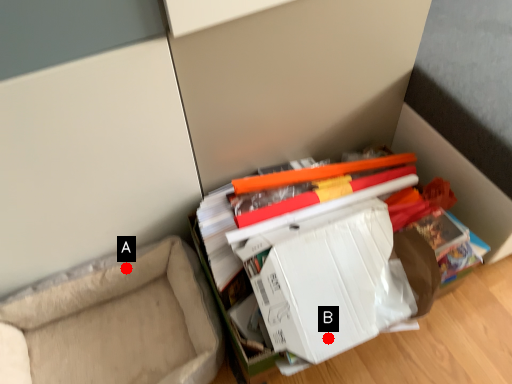
Question: Two points are circled on the image, labeled by A and B beside each circle. Which of the following is the farthest from the observer?

Choices:
 (A) A is further
 (B) B is further

Answer: (A)